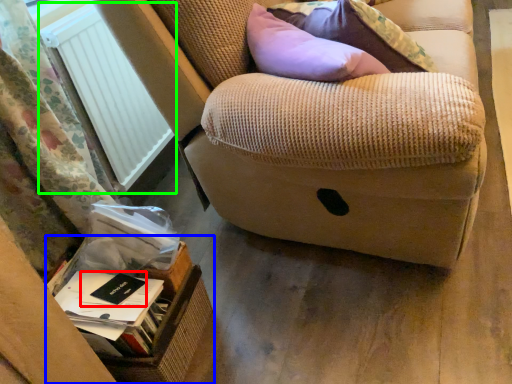
Question: Which is nearer to the paperback book (highlighted by a red box)? cardboard box (highlighted by a blue box) or radiator (highlighted by a green box).

Choices:
 (A) cardboard box
 (B) radiator

Answer: (A)